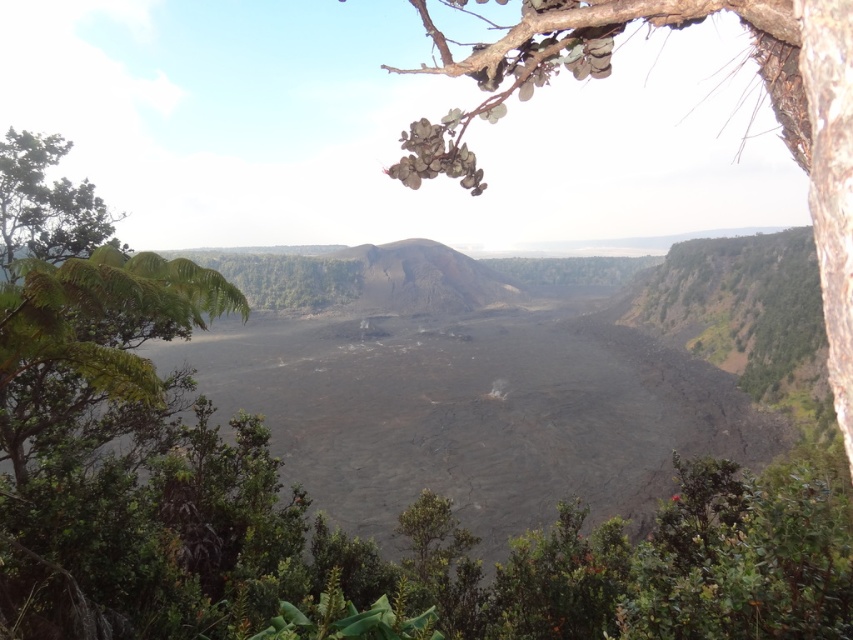
Question: Which object is farther from the camera taking this photo?

Choices:
 (A) green leafy branch at upper center
 (B) green leafy tree at upper left

Answer: (B)

Question: Among these objects, which one is farthest from the camera?

Choices:
 (A) green leafy branch at upper center
 (B) green leafy tree at upper left

Answer: (B)

Question: Does green leafy branch at upper center have a smaller size compared to green leafy tree at upper left?

Choices:
 (A) no
 (B) yes

Answer: (B)

Question: Which of the following is the closest to the observer?

Choices:
 (A) green leafy tree at upper left
 (B) green leafy branch at upper center

Answer: (B)

Question: Is green leafy branch at upper center closer to the viewer compared to green leafy tree at upper left?

Choices:
 (A) yes
 (B) no

Answer: (A)

Question: Is green leafy branch at upper center to the right of green leafy tree at upper left from the viewer's perspective?

Choices:
 (A) no
 (B) yes

Answer: (B)